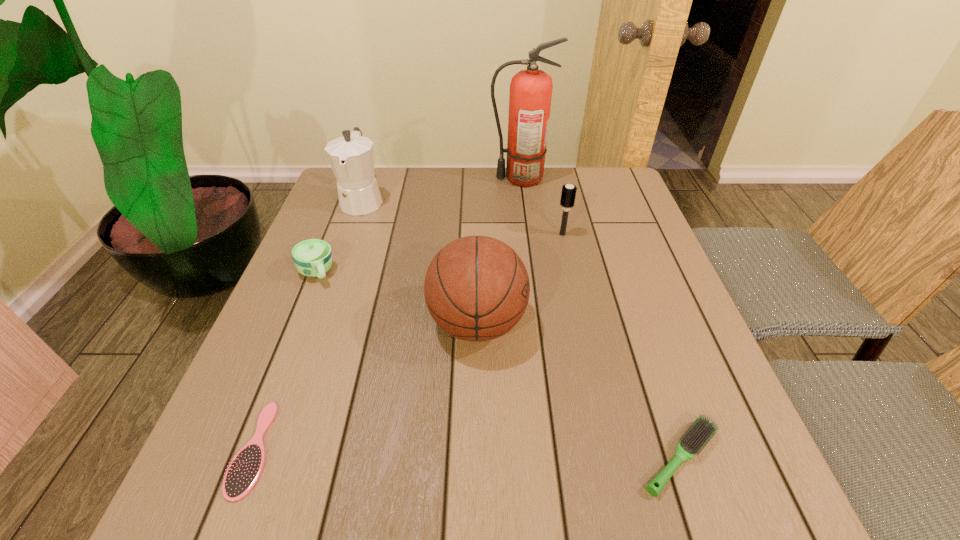
Identify the location of vacant region at the near edge of the desktop. The image size is (960, 540). (296, 521).

This screenshot has width=960, height=540. In the image, there is a desktop. Identify the location of vacant space at the left edge. (311, 278).

The image size is (960, 540). Find the location of `free space at the right edge of the desktop`. free space at the right edge of the desktop is located at coordinates (671, 284).

I want to click on vacant space at the near left corner, so click(x=259, y=508).

Locate an element on the screen. free point at the far right corner is located at coordinates point(578,176).

The width and height of the screenshot is (960, 540). In order to click on free space at the near right corner of the desktop in this screenshot , I will do `click(770, 519)`.

This screenshot has height=540, width=960. In order to click on vacant space that's between the coffeepot and the fifth nearest object in this screenshot , I will do `click(463, 217)`.

Image resolution: width=960 pixels, height=540 pixels. In order to click on free space between the tallest object and the fourth tallest object in this screenshot , I will do 541,206.

At what (x,y) coordinates should I click in order to perform the action: click on vacant area that lies between the rightmost object and the fifth tallest object. Please return your answer as a coordinate pair (x, y). The image size is (960, 540). Looking at the image, I should click on (498, 366).

This screenshot has height=540, width=960. What are the coordinates of `free area in between the fourth shortest object and the shortest hairbrush` in the screenshot? It's located at pos(408,341).